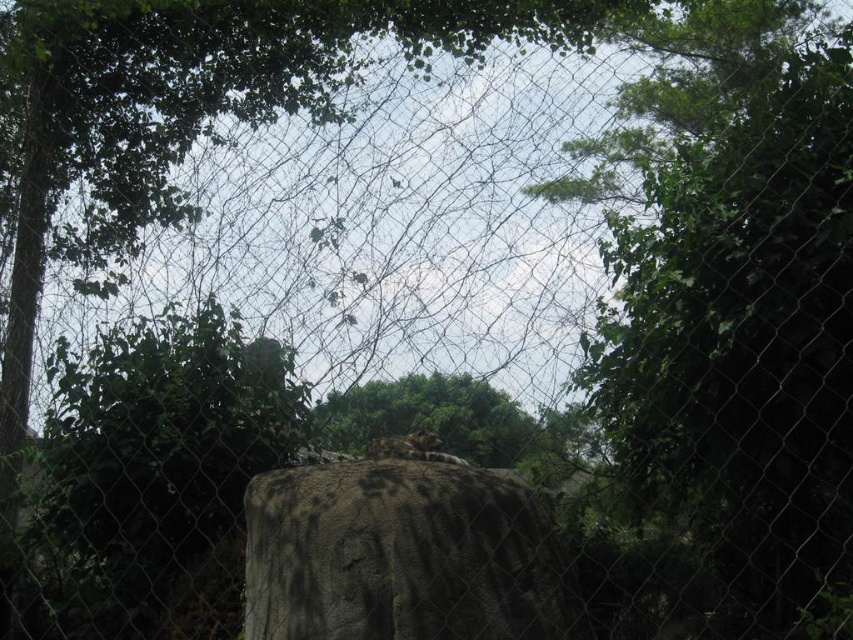
Can you confirm if green leafy tree at upper center is positioned to the left of rough textured stone at center?

No, green leafy tree at upper center is not to the left of rough textured stone at center.

Consider the image. Who is higher up, green leafy tree at upper center or rough textured stone at center?

green leafy tree at upper center

This screenshot has height=640, width=853. Describe the element at coordinates (730, 305) in the screenshot. I see `green leafy tree at upper center` at that location.

Locate an element on the screen. This screenshot has height=640, width=853. green leafy tree at upper center is located at coordinates (730, 305).

Is rough textured stone at center taller than brown fur tiger at center?

Indeed, rough textured stone at center has a greater height compared to brown fur tiger at center.

Which of these two, rough textured stone at center or brown fur tiger at center, stands taller?

rough textured stone at center is taller.

Is point (376, 557) positioned after point (381, 449)?

No, it is in front of (381, 449).

At what (x,y) coordinates should I click in order to perform the action: click on rough textured stone at center. Please return your answer as a coordinate pair (x, y). This screenshot has width=853, height=640. Looking at the image, I should click on click(x=403, y=556).

Is green leafy tree at upper center closer to camera compared to brown fur tiger at center?

Yes, green leafy tree at upper center is in front of brown fur tiger at center.

Can you confirm if green leafy tree at upper center is thinner than brown fur tiger at center?

In fact, green leafy tree at upper center might be wider than brown fur tiger at center.

Is point (715, 506) behind point (410, 436)?

That is True.

You are a GUI agent. You are given a task and a screenshot of the screen. Output one action in this format:
    pyautogui.click(x=<x>, y=<y>)
    Task: Click on the green leafy tree at upper center
    Image resolution: width=853 pixels, height=640 pixels.
    Given the screenshot: What is the action you would take?
    (730, 305)